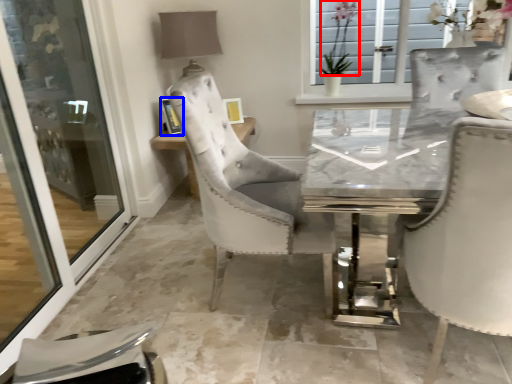
Question: Which object is closer to the camera taking this photo, flower (highlighted by a red box) or picture frame (highlighted by a blue box)?

Choices:
 (A) flower
 (B) picture frame

Answer: (B)